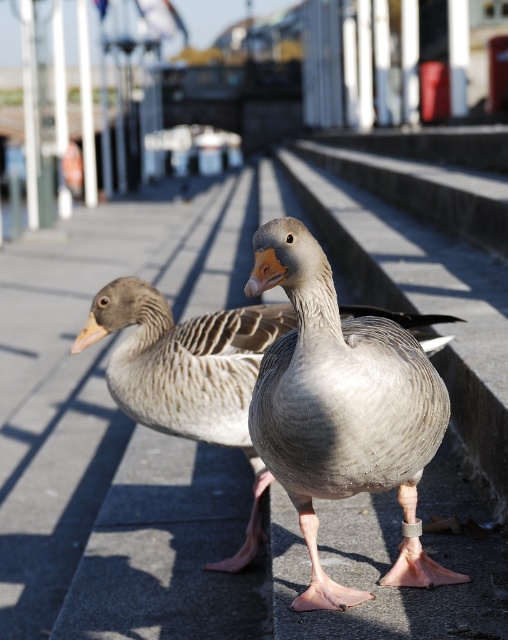
You are a photographer trying to capture a clear photo of both the gray feathered goose at center and the gray matte duck at center. Since you want to focus on the one farther away, which one should you aim your camera at?

The gray matte duck at center is farther away from the viewer than the gray feathered goose at center, so you should aim your camera at the gray matte duck at center to focus on the one farther away.

You are a photographer trying to capture a photo of the gray feathered goose at center. You are currently standing at the point marked at point (341, 408). Can you take the photo without moving?

The gray feathered goose at center is located at point (341, 408), so you are already standing at the position of the goose. You cannot take a photo of it from that spot because you are in the same location.

You are a photographer trying to capture a photo of the gray feathered goose at center and the gray matte duck at center. You need to ensure both are in focus. Given that your camera can focus on objects within a 30 inch range, will you be able to get both in focus?

The gray feathered goose at center and the gray matte duck at center are 38.19 inches apart from each other. Since the distance between them exceeds the camera focus range of 30 inches, you will not be able to get both in focus simultaneously.